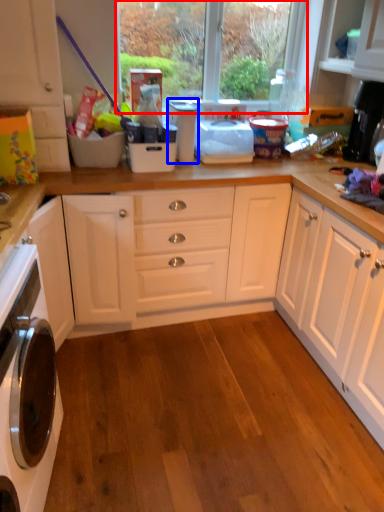
Question: Which object is further to the camera taking this photo, window screen (highlighted by a red box) or appliance (highlighted by a blue box)?

Choices:
 (A) window screen
 (B) appliance

Answer: (A)